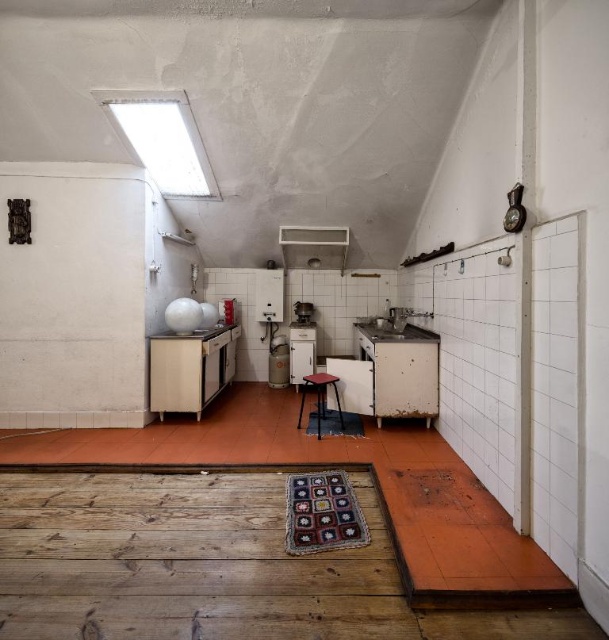
You are a delivery person trying to deliver a new microwave that is 1.2 meters wide. You need to place it in the kitchen where the white glossy exhaust hood at upper center and the white glossy refrigerator at center are located. Can the microwave fit horizontally between these two appliances?

The white glossy exhaust hood at upper center might be wider than the white glossy refrigerator at center, but since the microwave is 1.2 meters wide, we cannot determine if there is enough space without knowing the exact width of the exhaust hood.

You are moving a small stool from the crocheted rug at center to the white glossy refrigerator at center. Can you move it directly forward without moving it to the sides?

The crocheted rug at center is behind the white glossy refrigerator at center, so you cannot move the stool directly forward without moving it to the sides because the refrigerator is blocking the path.